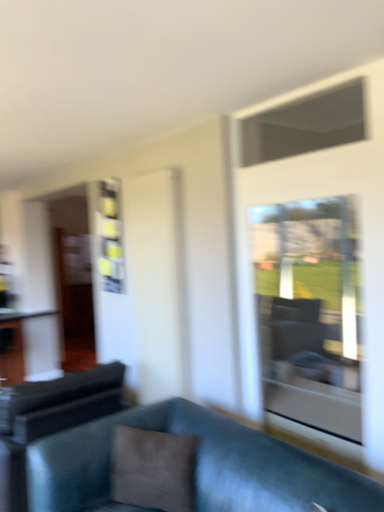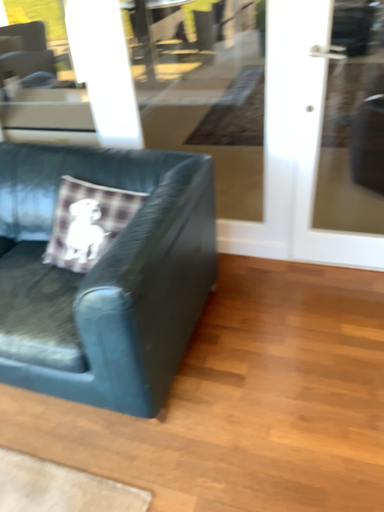
Question: Which way did the camera rotate in the video?

Choices:
 (A) rotated upward
 (B) rotated downward

Answer: (B)